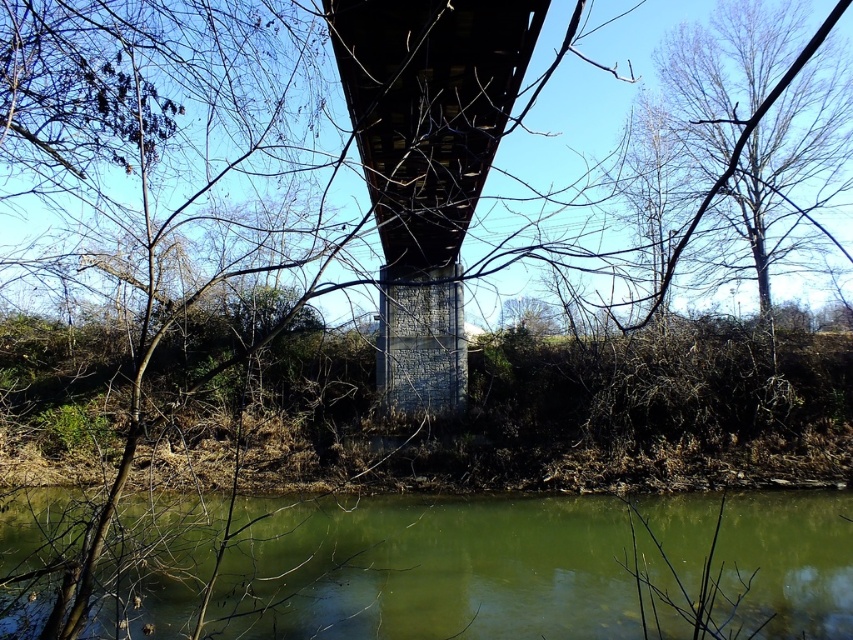
You are a drone operator trying to capture a photo of the bridge from above. The drone is currently hovering at point A, which is at coordinates 0.892, 0.515. You need to adjust the drone to avoid the green murky water at lower center. Which direction should you move the drone to stay clear of the water?

The green murky water at lower center is located at point (438,570). To avoid it, move the drone away from that coordinate, such as upwards or to the sides.

You are a kayaker planning to navigate under the bridge. The kayak is 1.5 meters wide. Based on the scene, will the kayak fit under the bridge considering the width of the green murky water at lower center and the concrete bridge at center?

The green murky water at lower center is wider than the concrete bridge at center. Since the kayak is 1.5 meters wide, and the bridge is narrower than the water, the kayak should be able to fit under the bridge as long as it stays within the bridge structure.